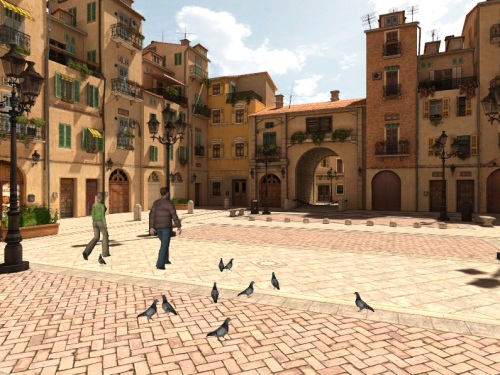
Locate an element on the screen. Image resolution: width=500 pixels, height=375 pixels. bench is located at coordinates pyautogui.click(x=234, y=211), pyautogui.click(x=486, y=220).